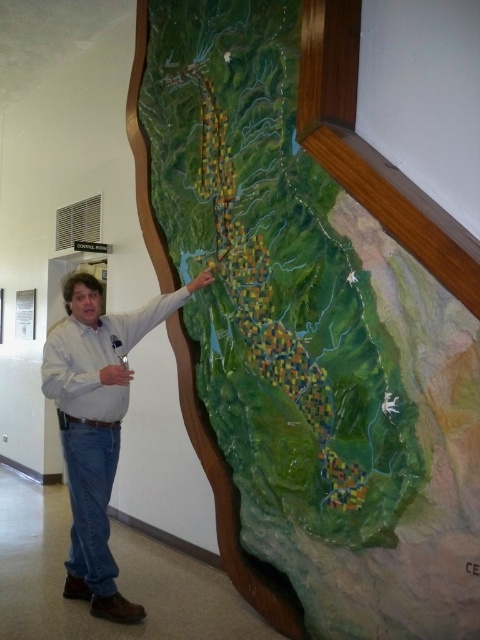
The width and height of the screenshot is (480, 640). Describe the element at coordinates (305, 339) in the screenshot. I see `green textured map at center` at that location.

Is green textured map at center shorter than denim jeans at center?

In fact, green textured map at center may be taller than denim jeans at center.

Who is more forward, (x=146, y=10) or (x=106, y=458)?

Point (x=106, y=458) is more forward.

Where is `green textured map at center`? The height and width of the screenshot is (640, 480). green textured map at center is located at coordinates (305, 339).